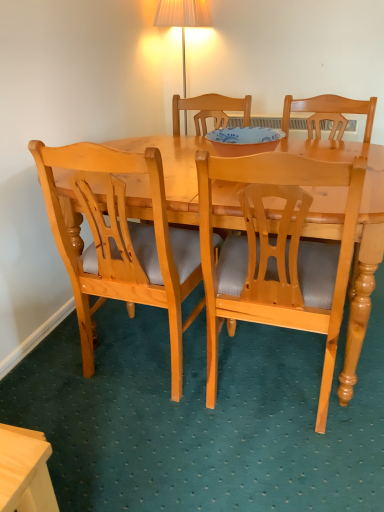
Question: From a real-world perspective, is light brown wood chair at left, the 2th chair in the right-to-left sequence, under blue glossy bowl at center?

Choices:
 (A) yes
 (B) no

Answer: (A)

Question: Is light brown wood chair at left, marked as the first chair in a left-to-right arrangement, completely or partially outside of blue glossy bowl at center?

Choices:
 (A) yes
 (B) no

Answer: (A)

Question: Considering the relative positions of light brown wood chair at left, the 2th chair in the right-to-left sequence, and blue glossy bowl at center in the image provided, is light brown wood chair at left, the 2th chair in the right-to-left sequence, to the right of blue glossy bowl at center from the viewer's perspective?

Choices:
 (A) yes
 (B) no

Answer: (B)

Question: Considering the relative positions of light brown wood chair at left, marked as the first chair in a left-to-right arrangement, and blue glossy bowl at center in the image provided, is light brown wood chair at left, marked as the first chair in a left-to-right arrangement, to the left of blue glossy bowl at center from the viewer's perspective?

Choices:
 (A) yes
 (B) no

Answer: (A)

Question: Is light brown wood chair at left, the 2th chair in the right-to-left sequence, touching blue glossy bowl at center?

Choices:
 (A) no
 (B) yes

Answer: (A)

Question: Could you tell me if light brown wood chair at left, the 2th chair in the right-to-left sequence, is turned towards blue glossy bowl at center?

Choices:
 (A) yes
 (B) no

Answer: (B)

Question: Can you confirm if light brown wood chair at left, marked as the first chair in a left-to-right arrangement, is wider than light brown wood chair at center, arranged as the second chair when viewed from the left?

Choices:
 (A) yes
 (B) no

Answer: (B)

Question: Does light brown wood chair at left, the 2th chair in the right-to-left sequence, have a lesser height compared to light brown wood chair at center, arranged as the second chair when viewed from the left?

Choices:
 (A) yes
 (B) no

Answer: (A)

Question: Is there a large distance between light brown wood chair at left, the 2th chair in the right-to-left sequence, and light brown wood chair at center, arranged as the second chair when viewed from the left?

Choices:
 (A) no
 (B) yes

Answer: (A)

Question: From the image's perspective, is light brown wood chair at left, the 2th chair in the right-to-left sequence, under light brown wood chair at center, which is the first chair in right-to-left order?

Choices:
 (A) no
 (B) yes

Answer: (A)

Question: From a real-world perspective, is light brown wood chair at left, the 2th chair in the right-to-left sequence, beneath light brown wood chair at center, arranged as the second chair when viewed from the left?

Choices:
 (A) no
 (B) yes

Answer: (A)

Question: Is light brown wood chair at left, marked as the first chair in a left-to-right arrangement, facing towards light brown wood chair at center, which is the first chair in right-to-left order?

Choices:
 (A) yes
 (B) no

Answer: (B)

Question: From the image's perspective, would you say blue glossy bowl at center is shown under light brown wood chair at center, which is the first chair in right-to-left order?

Choices:
 (A) no
 (B) yes

Answer: (A)